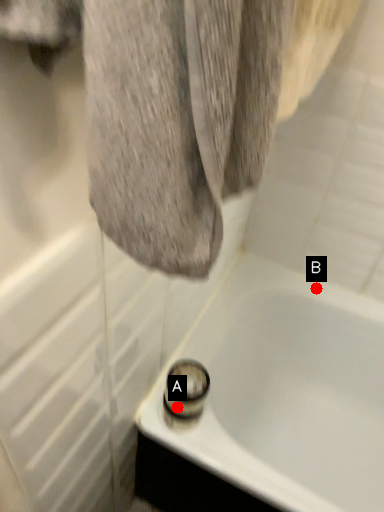
Question: Two points are circled on the image, labeled by A and B beside each circle. Which point is farther from the camera taking this photo?

Choices:
 (A) A is further
 (B) B is further

Answer: (B)